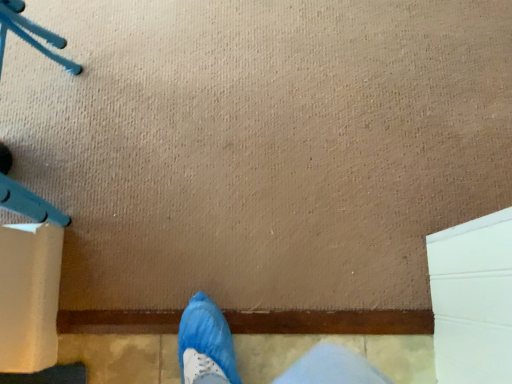
Identify the location of white cardboard box at lower left. The width and height of the screenshot is (512, 384). (29, 296).

Measure the distance between white cardboard box at lower left and camera.

white cardboard box at lower left and camera are 79.33 centimeters apart.

This screenshot has height=384, width=512. What do you see at coordinates (29, 296) in the screenshot?
I see `white cardboard box at lower left` at bounding box center [29, 296].

In order to click on white cardboard box at lower left in this screenshot , I will do tap(29, 296).